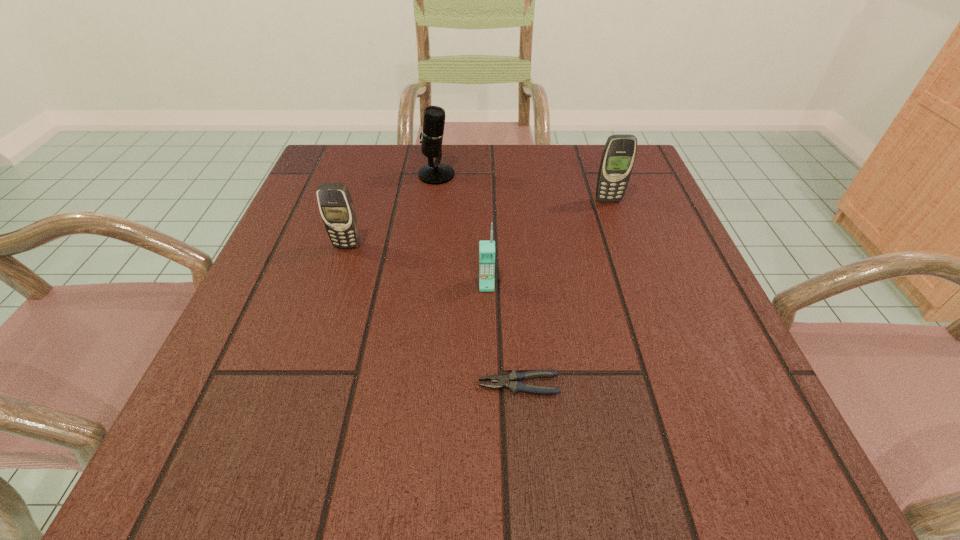
You are a GUI agent. You are given a task and a screenshot of the screen. Output one action in this format:
    pyautogui.click(x=<x>, y=<y>)
    Task: Click on the microphone
    Image resolution: width=960 pixels, height=540 pixels.
    Given the screenshot: What is the action you would take?
    pyautogui.click(x=434, y=173)

The image size is (960, 540). I want to click on the fourth object from right to left, so click(x=434, y=173).

Image resolution: width=960 pixels, height=540 pixels. In order to click on the rightmost cellular telephone in this screenshot , I will do `click(619, 153)`.

Image resolution: width=960 pixels, height=540 pixels. I want to click on the second farthest object, so click(619, 153).

This screenshot has width=960, height=540. What are the coordinates of `the leftmost cellular telephone` in the screenshot? It's located at (336, 206).

This screenshot has height=540, width=960. What are the coordinates of `the second farthest cellular telephone` in the screenshot? It's located at (336, 206).

This screenshot has width=960, height=540. Find the location of `the nearest cellular telephone`. the nearest cellular telephone is located at coordinates (486, 248).

Identify the location of the second cellular telephone from left to right. This screenshot has width=960, height=540. (486, 248).

The height and width of the screenshot is (540, 960). In order to click on the shortest object in this screenshot , I will do `click(514, 385)`.

The image size is (960, 540). I want to click on the nearest object, so click(x=514, y=385).